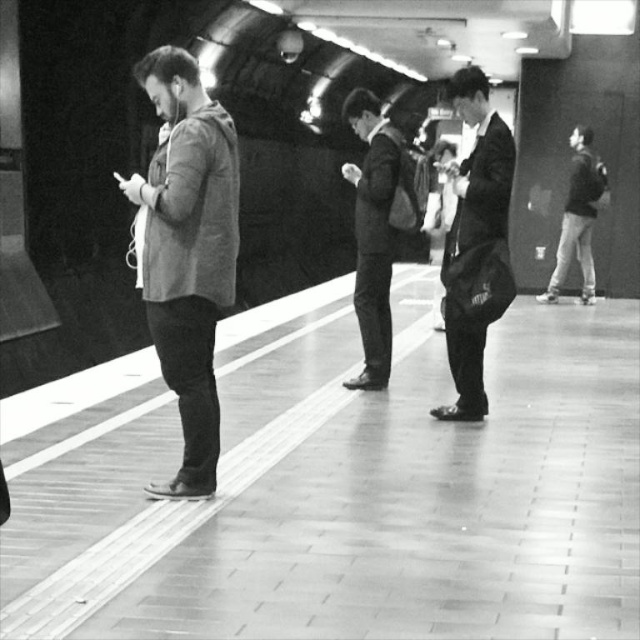
You are a photographer standing at point (376, 227) in the subway station. You want to take a picture of the dark suit at center. Is the dark suit at center visible from your current position?

The dark suit at center is located at point (376, 227), so yes, the photographer can see the dark suit at center from their current position because they are standing at the same point.